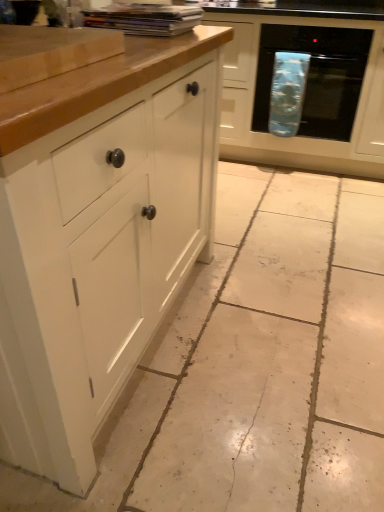
Question: Is white matte cabinet at left, the second cabinetry viewed from the right, shorter than matte white cabinet at center, the 1th cabinetry positioned from the right?

Choices:
 (A) yes
 (B) no

Answer: (A)

Question: Would you say white matte cabinet at left, marked as the 1th cabinetry in a left-to-right arrangement, is a long distance from matte white cabinet at center, marked as the second cabinetry in a front-to-back arrangement?

Choices:
 (A) yes
 (B) no

Answer: (A)

Question: Considering the relative sizes of white matte cabinet at left, acting as the 2th cabinetry starting from the back, and matte white cabinet at center, the second cabinetry viewed from the left, in the image provided, is white matte cabinet at left, acting as the 2th cabinetry starting from the back, wider than matte white cabinet at center, the second cabinetry viewed from the left,?

Choices:
 (A) yes
 (B) no

Answer: (A)

Question: Is white matte cabinet at left, the 1th cabinetry viewed from the front, thinner than matte white cabinet at center, marked as the second cabinetry in a front-to-back arrangement?

Choices:
 (A) no
 (B) yes

Answer: (A)

Question: Is the depth of white matte cabinet at left, the second cabinetry viewed from the right, less than that of matte white cabinet at center, the second cabinetry viewed from the left?

Choices:
 (A) no
 (B) yes

Answer: (B)

Question: From the image's perspective, is white matte cabinet at left, the 1th cabinetry viewed from the front, on matte white cabinet at center, the 1th cabinetry from the back?

Choices:
 (A) yes
 (B) no

Answer: (B)

Question: From the image's perspective, is blue fabric oven at right on top of white matte cabinet at left, the 1th cabinetry viewed from the front?

Choices:
 (A) yes
 (B) no

Answer: (A)

Question: Considering the relative sizes of blue fabric oven at right and white matte cabinet at left, marked as the 1th cabinetry in a left-to-right arrangement, in the image provided, is blue fabric oven at right thinner than white matte cabinet at left, marked as the 1th cabinetry in a left-to-right arrangement,?

Choices:
 (A) yes
 (B) no

Answer: (A)

Question: Can you confirm if blue fabric oven at right is taller than white matte cabinet at left, the 1th cabinetry viewed from the front?

Choices:
 (A) no
 (B) yes

Answer: (A)

Question: Considering the relative sizes of blue fabric oven at right and white matte cabinet at left, the second cabinetry viewed from the right, in the image provided, is blue fabric oven at right smaller than white matte cabinet at left, the second cabinetry viewed from the right,?

Choices:
 (A) yes
 (B) no

Answer: (A)

Question: From the image's perspective, is blue fabric oven at right under white matte cabinet at left, the second cabinetry viewed from the right?

Choices:
 (A) yes
 (B) no

Answer: (B)

Question: Considering the relative sizes of blue fabric oven at right and white matte cabinet at left, the second cabinetry viewed from the right, in the image provided, is blue fabric oven at right shorter than white matte cabinet at left, the second cabinetry viewed from the right,?

Choices:
 (A) yes
 (B) no

Answer: (A)

Question: Can you confirm if matte white cabinet at center, the 1th cabinetry positioned from the right, is shorter than white tile floor at center?

Choices:
 (A) yes
 (B) no

Answer: (B)